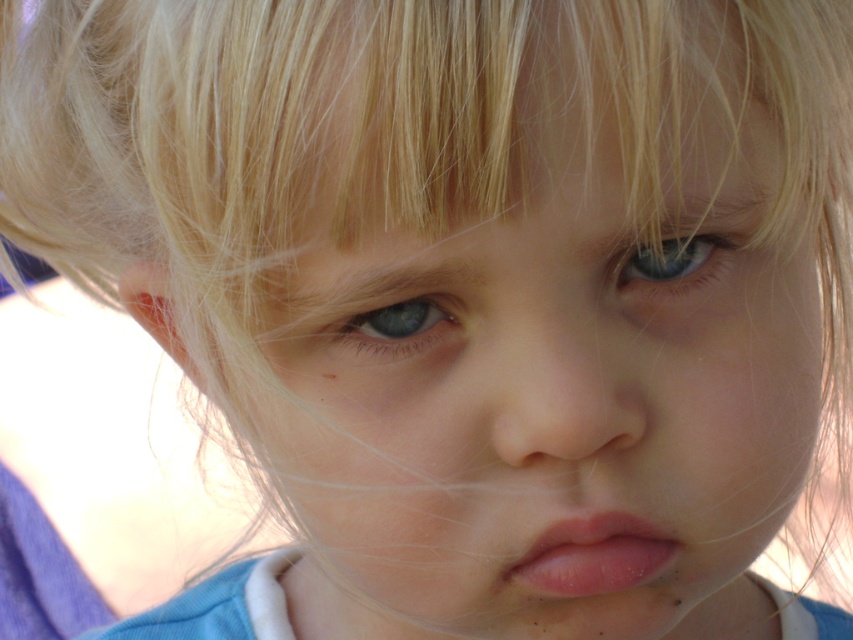
You are a photographer adjusting the focus of your camera. You need to ensure both the pink smooth lips at center and the blue matte eye at center are in focus. The camera can only focus on objects within a 2.5 inch range. Can both objects be in focus at the same time?

The distance between the pink smooth lips at center and the blue matte eye at center is 2.82 inches. Since the camera can only focus on objects within a 2.5 inch range, the two objects are too far apart to be in focus simultaneously.

You are a photographer analyzing the image. The blue matte eye at center and the blue glossy eye at upper center are both visible. Which eye appears closer to the camera?

The blue matte eye at center appears closer to the camera because it is positioned in front of the blue glossy eye at upper center.